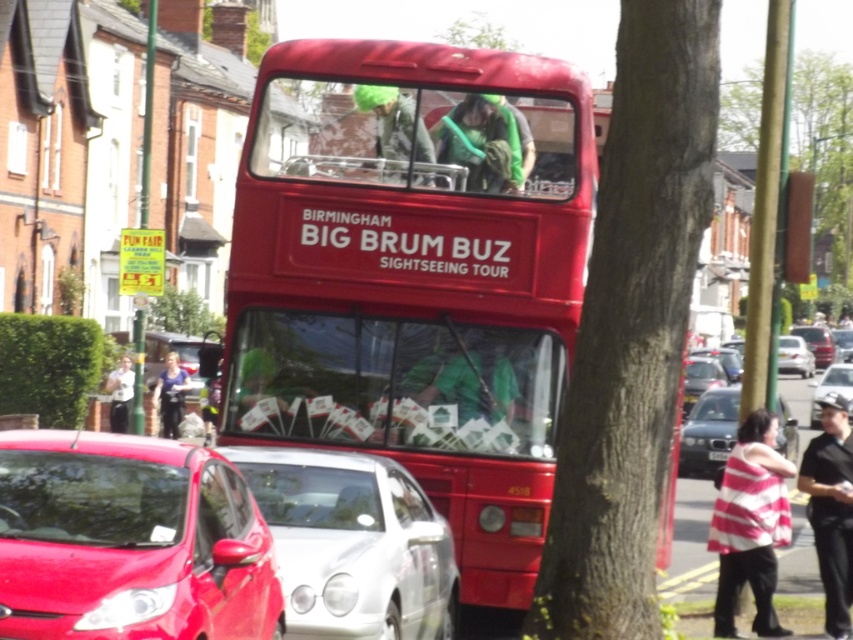
You are standing next to the shiny red car at lower left and want to take a photo of the red double decker bus in the center. The camera is 6.79 meters away from the shiny red car. Can you reach the camera in time to take the photo before the bus moves?

The shiny red car at lower left and camera are 6.79 meters apart from each other. Since the bus is stationary or moving slowly, you can easily reach the camera in time to take the photo.

You are a pedestrian standing on the sidewalk and want to cross the street safely. You see a green leafy tree at center and a shiny silver car at center. Which object is closer to you?

The green leafy tree at center is closer to you because the shiny silver car at center is behind it.

Based on the photo, you are a photographer trying to capture the shiny red car at lower left and the green leafy tree at center in a single shot. Which object will appear smaller in the photo?

The shiny red car at lower left will appear smaller in the photo because it occupies less space than the green leafy tree at center.